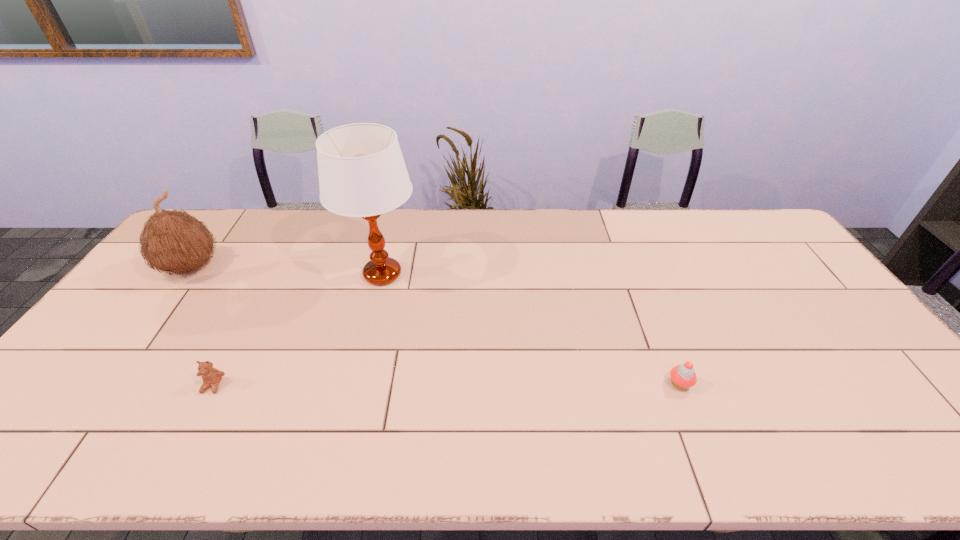
Identify the location of vacant space that satisfies the following two spatial constraints: 1. on the surface of the leftmost object; 2. on the left side of the second object from right to left. This screenshot has height=540, width=960. (186, 274).

The image size is (960, 540). I want to click on vacant region that satisfies the following two spatial constraints: 1. on the front side of the tallest object; 2. on the left side of the cupcake, so click(355, 384).

Where is `vacant region that satisfies the following two spatial constraints: 1. on the surface of the cupcake; 2. on the left side of the leftmost object`? vacant region that satisfies the following two spatial constraints: 1. on the surface of the cupcake; 2. on the left side of the leftmost object is located at coordinates [105, 384].

You are a GUI agent. You are given a task and a screenshot of the screen. Output one action in this format:
    pyautogui.click(x=<x>, y=<y>)
    Task: Click on the free location that satisfies the following two spatial constraints: 1. on the front side of the third object from left to right; 2. on the left side of the cupcake
    
    Given the screenshot: What is the action you would take?
    pyautogui.click(x=355, y=384)